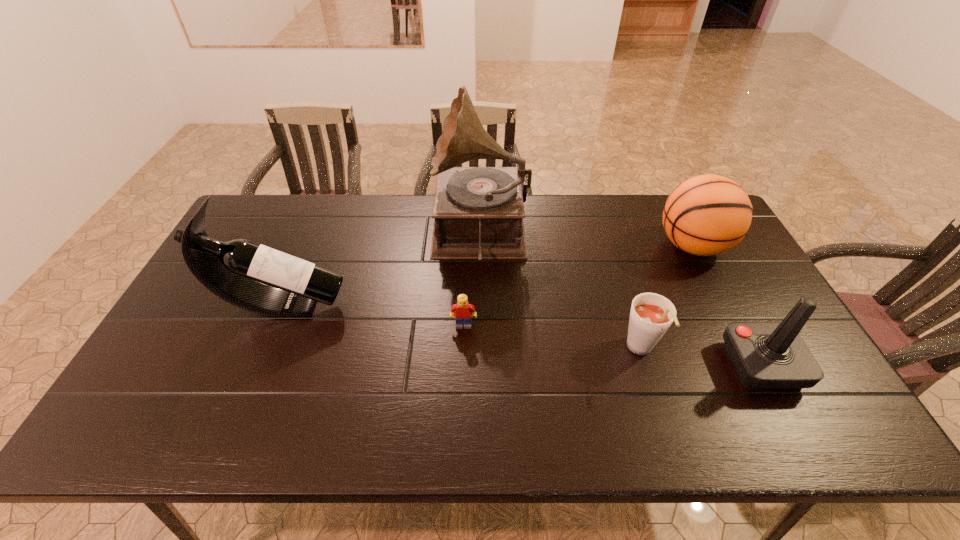
The width and height of the screenshot is (960, 540). I want to click on free spot between the joystick and the leftmost object, so coord(522,335).

Locate an element on the screen. Image resolution: width=960 pixels, height=540 pixels. free space between the tallest object and the wine bottle is located at coordinates (382, 271).

The height and width of the screenshot is (540, 960). What are the coordinates of `free space between the tallest object and the fourth object from left to right` in the screenshot? It's located at (561, 293).

You are a GUI agent. You are given a task and a screenshot of the screen. Output one action in this format:
    pyautogui.click(x=<x>, y=<y>)
    Task: Click on the empty space between the basketball and the shortest object
    
    Given the screenshot: What is the action you would take?
    pyautogui.click(x=578, y=286)

Locate an element on the screen. The width and height of the screenshot is (960, 540). free spot between the third farthest object and the basketball is located at coordinates (488, 276).

The height and width of the screenshot is (540, 960). What are the coordinates of `vacant space that's between the wine bottle and the basketball` in the screenshot? It's located at (488, 276).

This screenshot has width=960, height=540. I want to click on free space between the fourth object from left to right and the basketball, so click(x=666, y=298).

I want to click on object that is the fifth closest to the root beer, so click(x=234, y=271).

At what (x,y) coordinates should I click in order to perform the action: click on object that is the fifth closest one to the joystick. Please return your answer as a coordinate pair (x, y). Image resolution: width=960 pixels, height=540 pixels. Looking at the image, I should click on (234, 271).

Find the location of a particular element. vacant space that satisfies the following two spatial constraints: 1. from the horn of the record player; 2. on the left side of the joystick is located at coordinates (480, 366).